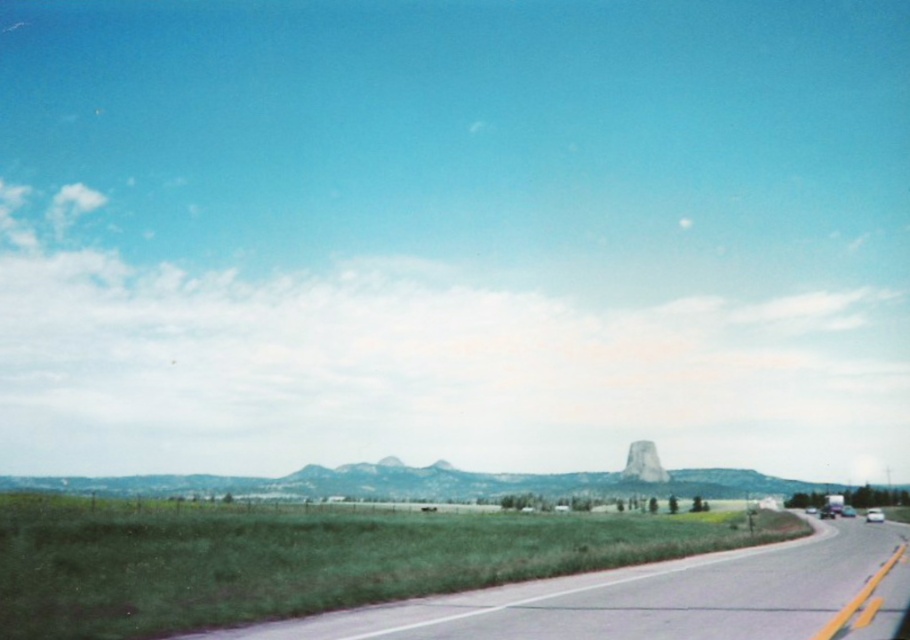
Between green stone butte at center and white glossy car at right, which one is positioned higher?

white glossy car at right is above.

Identify the location of green stone butte at center. (643, 464).

Who is more distant from viewer, (450, 608) or (875, 513)?

The point (875, 513) is more distant.

Between asphalt road at lower center and white glossy car at right, which one appears on the right side from the viewer's perspective?

Positioned to the right is white glossy car at right.

Is point (498, 637) less distant than point (868, 515)?

Yes, it is in front of point (868, 515).

The width and height of the screenshot is (910, 640). Find the location of `asphalt road at lower center`. asphalt road at lower center is located at coordinates (635, 596).

Locate an element on the screen. Image resolution: width=910 pixels, height=640 pixels. asphalt road at lower center is located at coordinates (635, 596).

Does asphalt road at lower center lie behind green stone butte at center?

No, it is in front of green stone butte at center.

Is point (589, 580) positioned after point (663, 470)?

No.

The width and height of the screenshot is (910, 640). In order to click on asphalt road at lower center in this screenshot , I will do `click(635, 596)`.